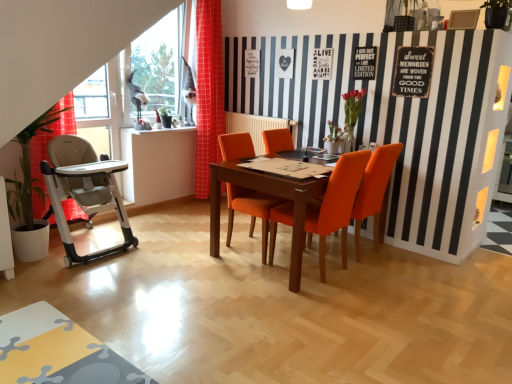
Question: Considering the positions of point (375, 221) and point (331, 196), is point (375, 221) closer or farther from the camera than point (331, 196)?

Choices:
 (A) farther
 (B) closer

Answer: (A)

Question: Is orange fabric chair at center, the 3th chair positioned from the left, taller or shorter than orange fabric chair at center, the second chair viewed from the left?

Choices:
 (A) short
 (B) tall

Answer: (B)

Question: Which of these objects is positioned farthest from the orange fabric chair at center, which ranks as the first chair in right-to-left order?

Choices:
 (A) green leafy plant at left
 (B) transparent glass window at upper left
 (C) orange fabric chair at center, the second chair viewed from the left
 (D) red checkered curtain at left
 (E) orange fabric chair at center, the 3th chair positioned from the right

Answer: (B)

Question: Which object is the farthest from the orange fabric chair at center, which ranks as the first chair in right-to-left order?

Choices:
 (A) green leafy plant at left
 (B) red checkered curtain at left
 (C) transparent glass window at upper left
 (D) orange fabric chair at center, the second chair viewed from the left
 (E) orange fabric chair at center, the 3th chair positioned from the right

Answer: (C)